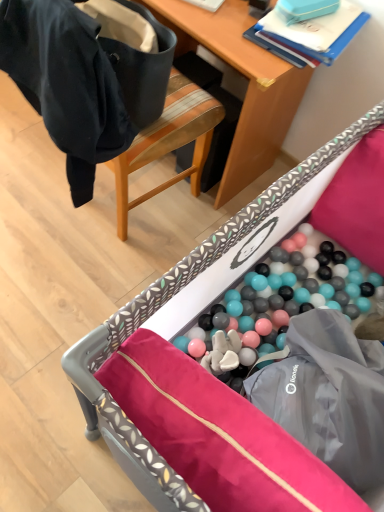
Question: Can you confirm if plastic ball pit at lower center is positioned to the left of black fabric chair at upper left?

Choices:
 (A) no
 (B) yes

Answer: (A)

Question: Is plastic ball pit at lower center not close to black fabric chair at upper left?

Choices:
 (A) yes
 (B) no

Answer: (B)

Question: Is plastic ball pit at lower center taller than black fabric chair at upper left?

Choices:
 (A) yes
 (B) no

Answer: (B)

Question: Can you confirm if plastic ball pit at lower center is thinner than black fabric chair at upper left?

Choices:
 (A) yes
 (B) no

Answer: (B)

Question: Is plastic ball pit at lower center wider than black fabric chair at upper left?

Choices:
 (A) yes
 (B) no

Answer: (A)

Question: Is plastic ball pit at lower center to the right of black fabric chair at upper left from the viewer's perspective?

Choices:
 (A) yes
 (B) no

Answer: (A)

Question: From a real-world perspective, is black fabric chair at upper left on top of wooden desk at upper center?

Choices:
 (A) yes
 (B) no

Answer: (A)

Question: Is black fabric chair at upper left located outside wooden desk at upper center?

Choices:
 (A) no
 (B) yes

Answer: (B)

Question: Is wooden desk at upper center at the back of black fabric chair at upper left?

Choices:
 (A) yes
 (B) no

Answer: (B)

Question: Considering the relative positions of black fabric chair at upper left and wooden desk at upper center in the image provided, is black fabric chair at upper left in front of wooden desk at upper center?

Choices:
 (A) yes
 (B) no

Answer: (A)

Question: Is wooden desk at upper center located within black fabric chair at upper left?

Choices:
 (A) yes
 (B) no

Answer: (B)

Question: From the image's perspective, is black fabric chair at upper left on wooden desk at upper center?

Choices:
 (A) no
 (B) yes

Answer: (A)

Question: Is wooden desk at upper center oriented away from plastic ball pit at lower center?

Choices:
 (A) yes
 (B) no

Answer: (B)